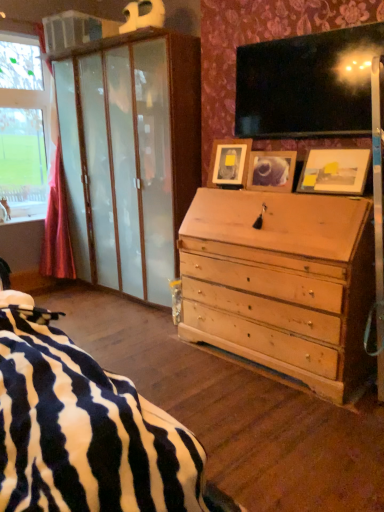
Question: Based on their positions, is wooden photo frame at upper right, positioned as the first picture frame in right-to-left order, located to the left or right of wooden picture frame at center, which ranks as the third picture frame in right-to-left order?

Choices:
 (A) right
 (B) left

Answer: (A)

Question: Is point (360, 167) closer or farther from the camera than point (243, 161)?

Choices:
 (A) closer
 (B) farther

Answer: (A)

Question: Based on their relative distances, which object is farther from the wooden picture frame at center, acting as the second picture frame starting from the right?

Choices:
 (A) wooden picture frame at center, which ranks as the third picture frame in right-to-left order
 (B) wooden photo frame at upper right, positioned as the first picture frame in right-to-left order

Answer: (B)

Question: Which object is positioned closest to the wooden picture frame at center, acting as the second picture frame starting from the right?

Choices:
 (A) wooden picture frame at center, which ranks as the third picture frame in right-to-left order
 (B) wooden photo frame at upper right, positioned as the first picture frame in right-to-left order

Answer: (A)